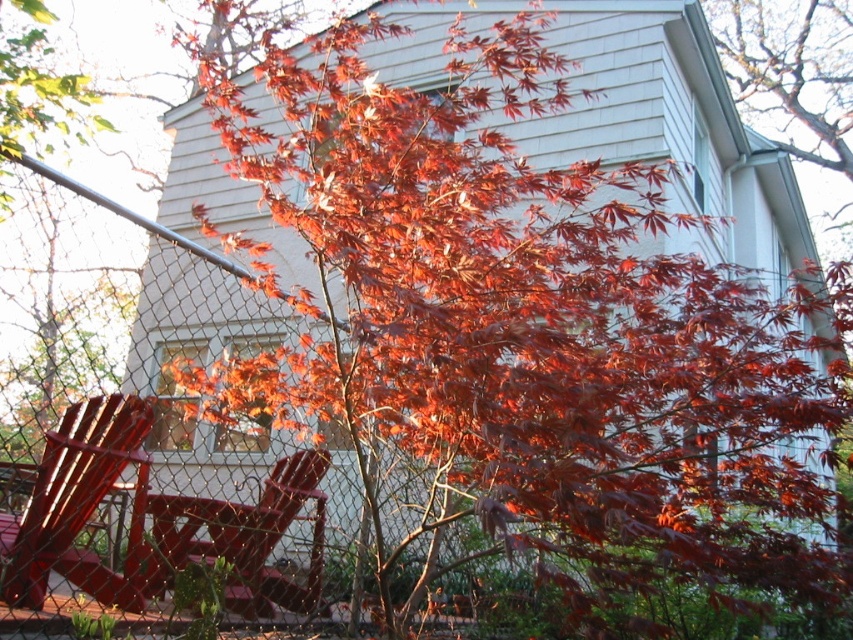
Which is above, metallic red chair at lower left or matte red chair at lower left?

metallic red chair at lower left is higher up.

Does metallic red chair at lower left appear on the left side of matte red chair at lower left?

Yes, metallic red chair at lower left is to the left of matte red chair at lower left.

The height and width of the screenshot is (640, 853). What do you see at coordinates (79, 506) in the screenshot?
I see `metallic red chair at lower left` at bounding box center [79, 506].

Locate an element on the screen. The height and width of the screenshot is (640, 853). metallic red chair at lower left is located at coordinates (79, 506).